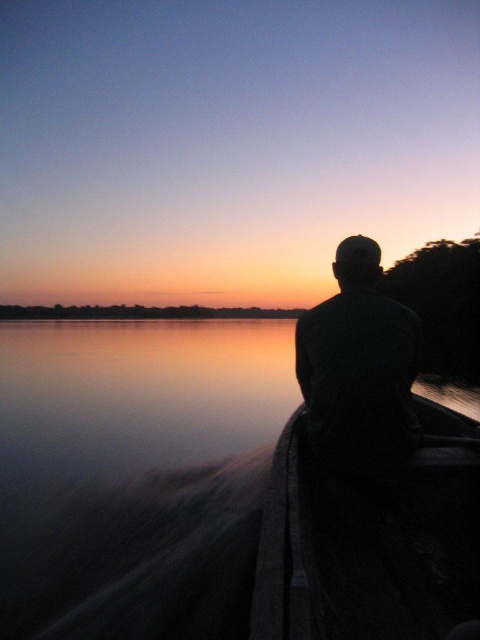
Is point (71, 388) closer to camera compared to point (334, 532)?

No, (71, 388) is behind (334, 532).

Measure the distance between smooth water at boat right and dark wood canoe at right.

smooth water at boat right and dark wood canoe at right are 21.43 feet apart from each other.

Locate an element on the screen. smooth water at boat right is located at coordinates click(x=205, y=499).

Is dark wood canoe at right thinner than dark green fabric at center?

Incorrect, dark wood canoe at right's width is not less than dark green fabric at center's.

Measure the distance between dark wood canoe at right and camera.

They are 4.48 feet apart.

What do you see at coordinates (370, 541) in the screenshot? I see `dark wood canoe at right` at bounding box center [370, 541].

The height and width of the screenshot is (640, 480). I want to click on dark wood canoe at right, so click(370, 541).

Is point (216, 362) closer to camera compared to point (336, 355)?

No, (216, 362) is behind (336, 355).

Which is behind, point (128, 595) or point (397, 440)?

Point (128, 595)

At what (x,y) coordinates should I click in order to perform the action: click on smooth water at boat right. Please return your answer as a coordinate pair (x, y). The width and height of the screenshot is (480, 640). Looking at the image, I should click on (205, 499).